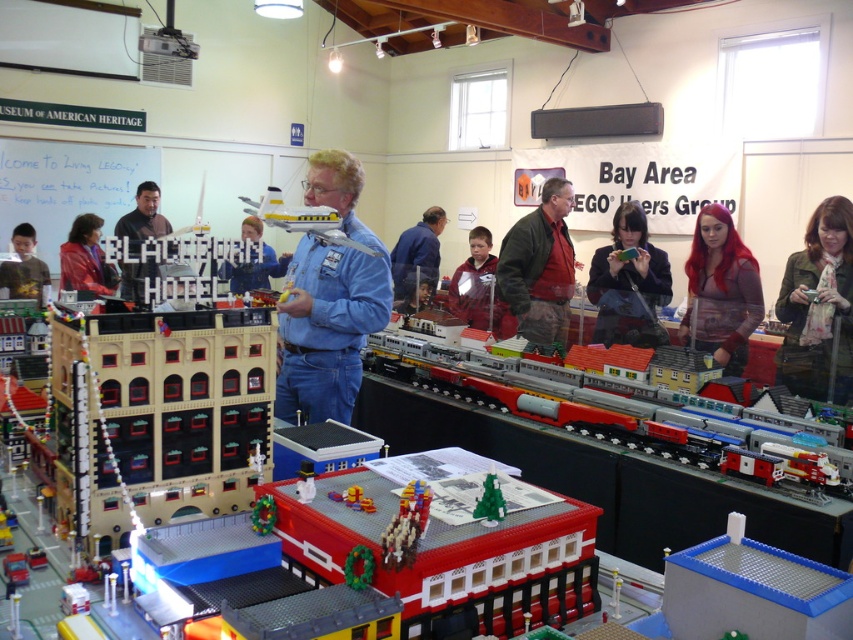
Question: From the image, what is the correct spatial relationship of plaid shirt at center in relation to blue denim jeans at center?

Choices:
 (A) below
 (B) above

Answer: (A)

Question: Is shiny red jacket at center to the left of yellow shirt at left from the viewer's perspective?

Choices:
 (A) no
 (B) yes

Answer: (A)

Question: Is metallic silver train at center wider than denim jacket at center?

Choices:
 (A) yes
 (B) no

Answer: (A)

Question: Which point appears closest to the camera in this image?

Choices:
 (A) (695, 461)
 (B) (592, 296)
 (C) (410, 285)

Answer: (A)

Question: Which is nearer to the blue denim jeans at center?

Choices:
 (A) yellow shirt at left
 (B) brown textured scarf at upper right
 (C) whiteboard at upper left
 (D) denim jacket at center

Answer: (D)

Question: Which point is closer to the camera?

Choices:
 (A) click(x=259, y=227)
 (B) click(x=560, y=243)

Answer: (B)